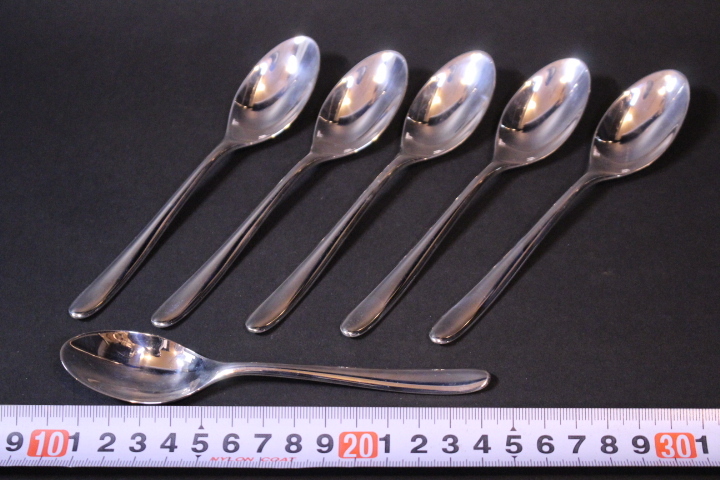
The image size is (720, 480). I want to click on spoons, so click(153, 374), click(261, 98), click(366, 120), click(445, 115), click(522, 119), click(634, 133).